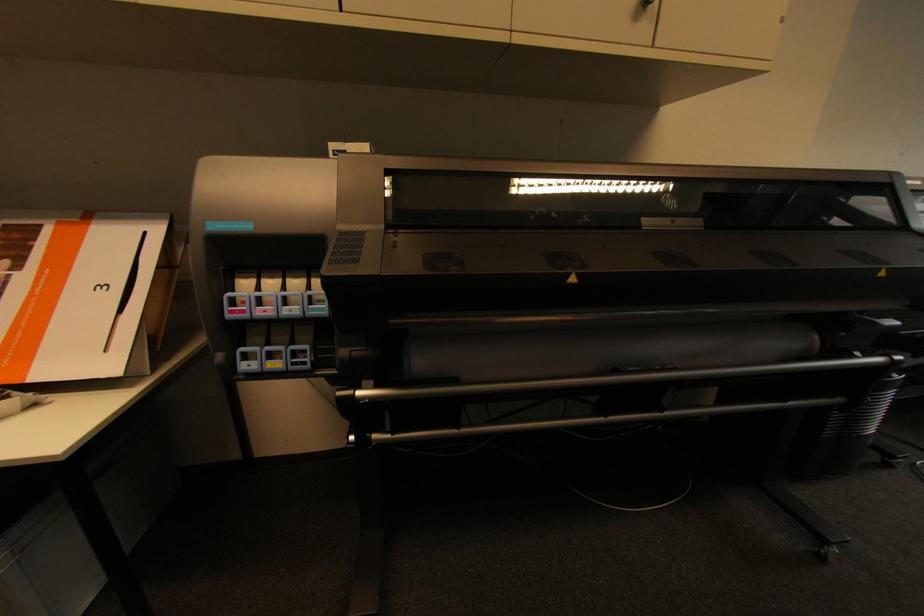
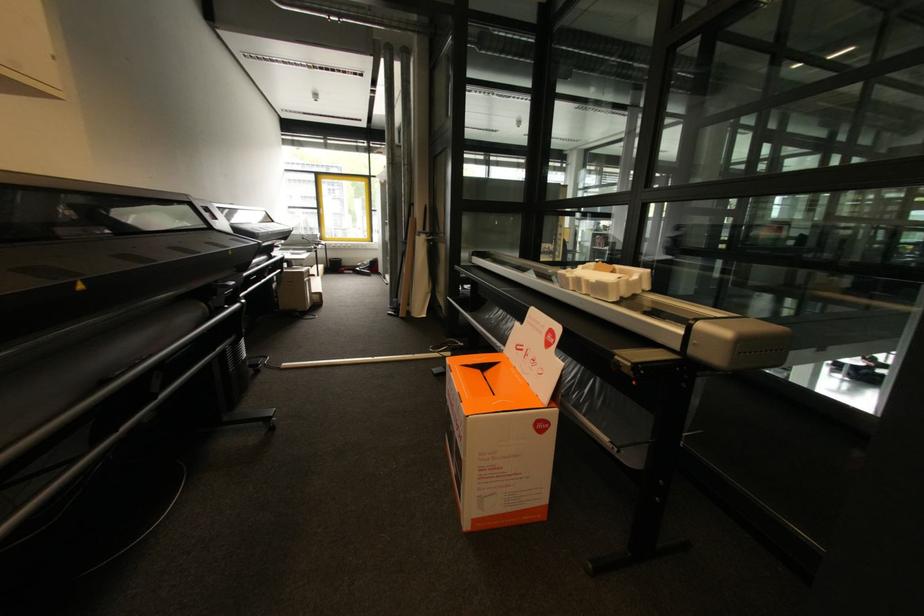
The images are taken continuously from a first-person perspective. In which direction is your viewpoint rotating?

The camera's rotation is toward right-down.